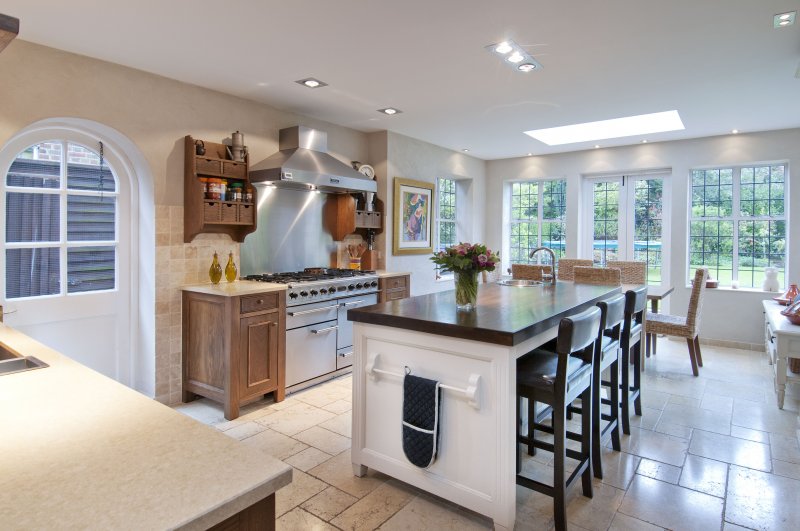
Locate an element on the screen. The width and height of the screenshot is (800, 531). tile is located at coordinates (657, 488).